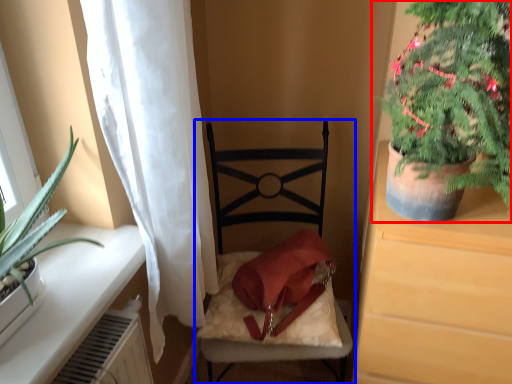
Question: Which point is further to the camera, houseplant (highlighted by a red box) or chair (highlighted by a blue box)?

Choices:
 (A) houseplant
 (B) chair

Answer: (B)